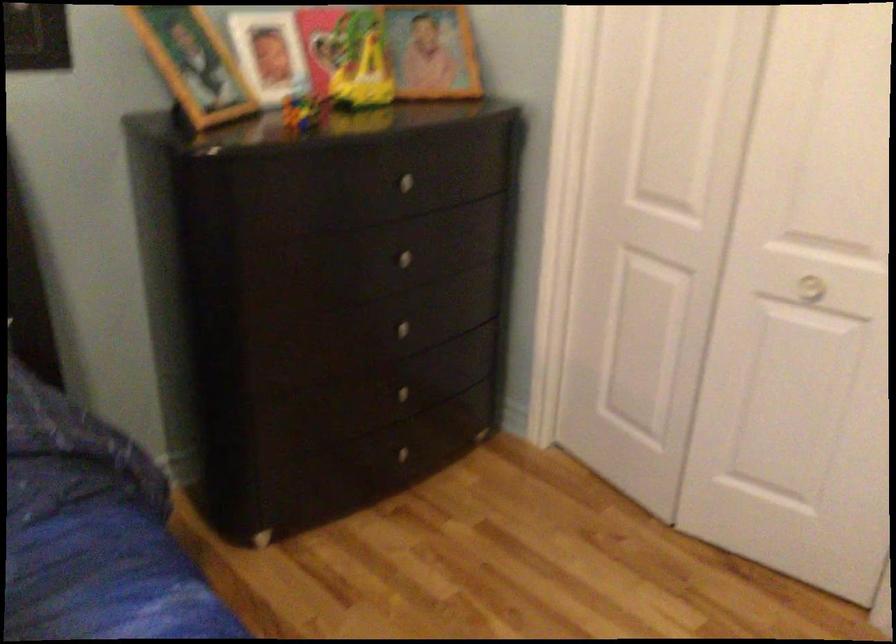
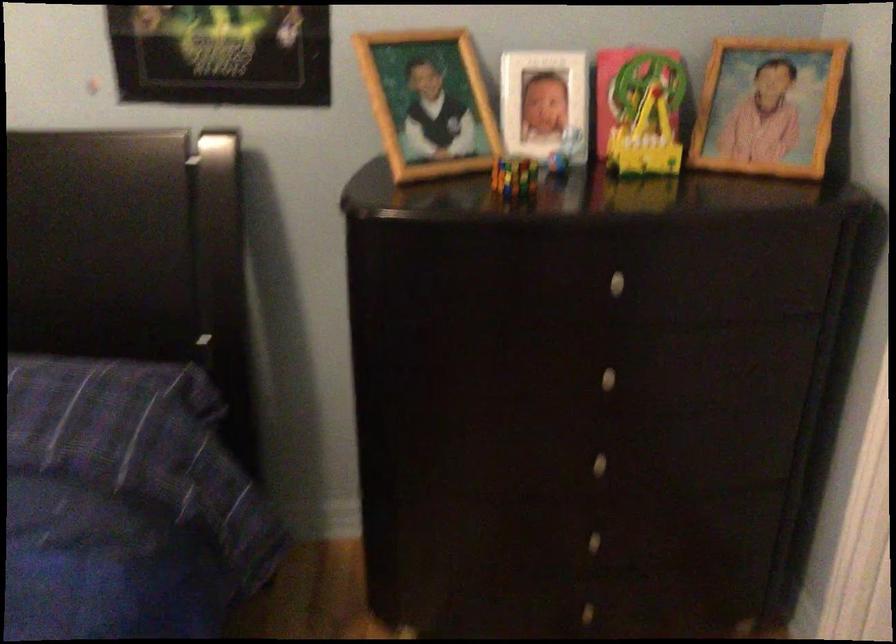
Question: The camera is either moving clockwise (left) or counter-clockwise (right) around the object. The first image is from the beginning of the video and the second image is from the end. Is the camera moving left or right when shooting the video?

Choices:
 (A) Left
 (B) Right

Answer: (B)